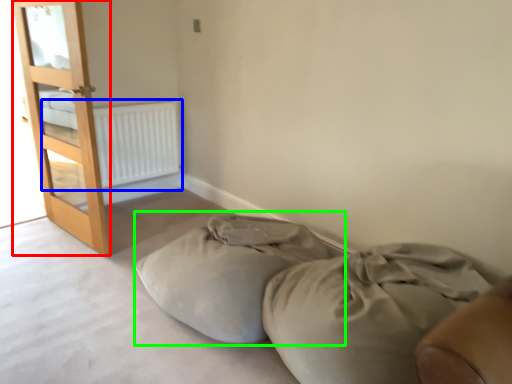
Question: Which is nearer to the door (highlighted by a red box)? radiator (highlighted by a blue box) or bean bag chair (highlighted by a green box).

Choices:
 (A) radiator
 (B) bean bag chair

Answer: (A)